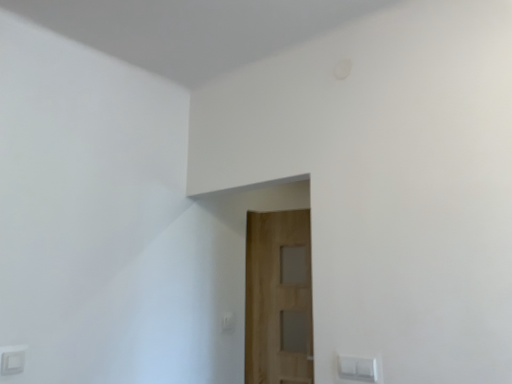
This screenshot has height=384, width=512. Describe the element at coordinates (278, 298) in the screenshot. I see `wooden door at center` at that location.

This screenshot has height=384, width=512. I want to click on wooden door at center, so coord(278,298).

Measure the distance between point (259, 271) and camera.

The distance of point (259, 271) from camera is 2.89 meters.

Identify the location of white plastic light switch at lower center. (227, 321).

Describe the element at coordinates (227, 321) in the screenshot. I see `white plastic light switch at lower center` at that location.

This screenshot has height=384, width=512. I want to click on wooden door at center, so click(278, 298).

Is wooden door at center to the left or to the right of white plastic light switch at lower center in the image?

Clearly, wooden door at center is on the right of white plastic light switch at lower center in the image.

Considering the relative positions of wooden door at center and white plastic light switch at lower center in the image provided, is wooden door at center in front of white plastic light switch at lower center?

Yes, wooden door at center is in front of white plastic light switch at lower center.

Does point (272, 349) appear closer or farther from the camera than point (232, 318)?

Point (272, 349) appears to be farther away from the viewer than point (232, 318).

From the image's perspective, which one is positioned higher, wooden door at center or white plastic light switch at lower center?

wooden door at center appears higher in the image.

From a real-world perspective, relative to white plastic light switch at lower center, is wooden door at center vertically above or below?

From a real-world perspective, wooden door at center is physically above white plastic light switch at lower center.

Consider the image. Can you confirm if wooden door at center is thinner than white plastic light switch at lower center?

In fact, wooden door at center might be wider than white plastic light switch at lower center.

Considering the relative sizes of wooden door at center and white plastic light switch at lower center in the image provided, is wooden door at center shorter than white plastic light switch at lower center?

No, wooden door at center is not shorter than white plastic light switch at lower center.

Does wooden door at center have a larger size compared to white plastic light switch at lower center?

Indeed, wooden door at center has a larger size compared to white plastic light switch at lower center.

Is white plastic light switch at lower center inside wooden door at center?

No, white plastic light switch at lower center is not a part of wooden door at center.

Is wooden door at center far away from white plastic light switch at lower center?

No.

Could you tell me if wooden door at center is turned towards white plastic light switch at lower center?

Yes, wooden door at center is oriented towards white plastic light switch at lower center.

How far apart are wooden door at center and white plastic light switch at lower center?

The distance of wooden door at center from white plastic light switch at lower center is 41.88 centimeters.

Identify the location of light switch behind the wooden door at center. The height and width of the screenshot is (384, 512). (227, 321).

Considering the positions of objects white plastic light switch at lower center and wooden door at center in the image provided, who is more to the right, white plastic light switch at lower center or wooden door at center?

wooden door at center is more to the right.

Relative to wooden door at center, is white plastic light switch at lower center in front or behind?

Clearly, white plastic light switch at lower center is behind wooden door at center.

Which is further, (x=225, y=321) or (x=309, y=270)?

The point (x=309, y=270) is behind.

From the image's perspective, is white plastic light switch at lower center below wooden door at center?

Indeed, from the image's perspective, white plastic light switch at lower center is shown beneath wooden door at center.

From a real-world perspective, is white plastic light switch at lower center over wooden door at center?

Actually, white plastic light switch at lower center is physically below wooden door at center in the real world.

Which of these two, white plastic light switch at lower center or wooden door at center, is wider?

Wider between the two is wooden door at center.

Is white plastic light switch at lower center taller than wooden door at center?

Incorrect, the height of white plastic light switch at lower center is not larger of that of wooden door at center.

Looking at the image, does white plastic light switch at lower center seem bigger or smaller compared to wooden door at center?

Clearly, white plastic light switch at lower center is smaller in size than wooden door at center.

In the scene shown: Is white plastic light switch at lower center located outside wooden door at center?

white plastic light switch at lower center is positioned outside wooden door at center.

Looking at this image, are white plastic light switch at lower center and wooden door at center located far from each other?

No, white plastic light switch at lower center is not far from wooden door at center.

Is white plastic light switch at lower center facing away from wooden door at center?

No.

How different are the orientations of white plastic light switch at lower center and wooden door at center in degrees?

white plastic light switch at lower center and wooden door at center are facing 80.7 degrees away from each other.

Consider the image. How distant is white plastic light switch at lower center from wooden door at center?

A distance of 16.49 inches exists between white plastic light switch at lower center and wooden door at center.

Find the location of a particular element. The width and height of the screenshot is (512, 384). door above the white plastic light switch at lower center (from the image's perspective) is located at coordinates coord(278,298).

Where is `light switch below the wooden door at center (from a real-world perspective)`? light switch below the wooden door at center (from a real-world perspective) is located at coordinates (227, 321).

At what (x,y) coordinates should I click in order to perform the action: click on light switch lying on the left of wooden door at center. Please return your answer as a coordinate pair (x, y). Looking at the image, I should click on (227, 321).